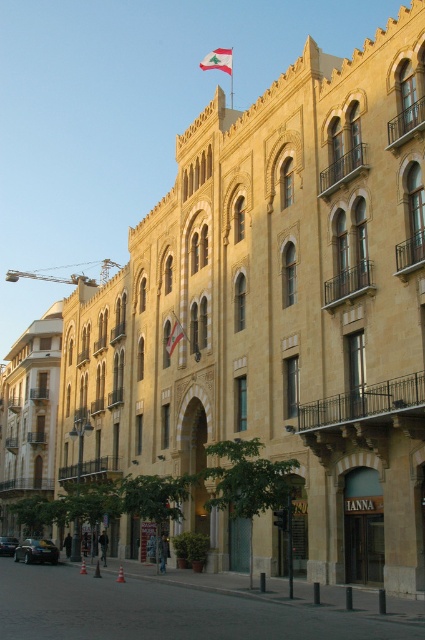
You are standing in front of the beige stone building at left and the red fabric flag at upper center. Which object is wider?

The beige stone building at left is wider than the red fabric flag at upper center according to the description.

You are standing in front of the grand building and want to take a photo. You notice two points marked on the building. The first point is at coordinate point (39,435) and the second is at point (214,60). Which point is closer to you?

Point (39,435) is closer to the viewer than point (214,60).

Looking at this image, you are a photographer planning to capture the building with both the red fabric flag at upper center and the white fabric flag at center in the frame. Which flag will appear larger in your photo?

The red fabric flag at upper center will appear larger in the photo because it has a larger size compared to the white fabric flag at center.